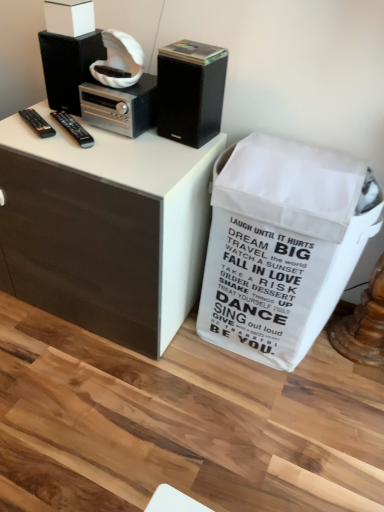
The height and width of the screenshot is (512, 384). Describe the element at coordinates (69, 17) in the screenshot. I see `white matte box at upper left` at that location.

What is the approximate width of black plastic remote at left, the 2th remote control from the right?

The width of black plastic remote at left, the 2th remote control from the right, is 1.70 inches.

Where is `silver metallic stereo at upper center`? silver metallic stereo at upper center is located at coordinates (120, 106).

Image resolution: width=384 pixels, height=512 pixels. Describe the element at coordinates (190, 91) in the screenshot. I see `black matte speaker at upper right, which is counted as the first loudspeaker, starting from the right` at that location.

In order to face black matte speaker at upper right, which is counted as the first loudspeaker, starting from the right, should I rotate leftwards or rightwards?

A 0.259 degree turn to the left will do.

What do you see at coordinates (68, 66) in the screenshot? I see `black matte speaker at upper left, which is the second loudspeaker from right to left` at bounding box center [68, 66].

Locate an element on the screen. The width and height of the screenshot is (384, 512). white matte trash bin/can at lower right is located at coordinates (282, 245).

Which object is wider, silver metallic stereo at upper center or black plastic remote at left, arranged as the second remote control when viewed from the left?

silver metallic stereo at upper center.

Which of these two, silver metallic stereo at upper center or black plastic remote at left, which is counted as the first remote control, starting from the right, is smaller?

With smaller size is black plastic remote at left, which is counted as the first remote control, starting from the right.

Is point (109, 103) behind point (65, 118)?

No, it is in front of (65, 118).

Is silver metallic stereo at upper center placed right next to black plastic remote at left, arranged as the second remote control when viewed from the left?

silver metallic stereo at upper center is not next to black plastic remote at left, arranged as the second remote control when viewed from the left, and they're not touching.

From the image's perspective, between white matte box at upper left and black plastic remote at left, the 2th remote control from the right, who is located below?

black plastic remote at left, the 2th remote control from the right, appears lower in the image.

Is white matte box at upper left placed right next to black plastic remote at left, arranged as the first remote control when viewed from the left?

No.

Is white matte box at upper left in front of or behind black plastic remote at left, arranged as the first remote control when viewed from the left, in the image?

Clearly, white matte box at upper left is in front of black plastic remote at left, arranged as the first remote control when viewed from the left.

In the scene shown: Between white matte box at upper left and black plastic remote at left, the 2th remote control from the right, which one appears on the left side from the viewer's perspective?

black plastic remote at left, the 2th remote control from the right.

From a real-world perspective, which is physically above, black plastic remote at left, arranged as the first remote control when viewed from the left, or black plastic remote at left, arranged as the second remote control when viewed from the left?

black plastic remote at left, arranged as the second remote control when viewed from the left, from a real-world perspective.

Can you confirm if black plastic remote at left, the 2th remote control from the right, is positioned to the right of black plastic remote at left, which is counted as the first remote control, starting from the right?

No, black plastic remote at left, the 2th remote control from the right, is not to the right of black plastic remote at left, which is counted as the first remote control, starting from the right.

Which object is wider, black plastic remote at left, arranged as the first remote control when viewed from the left, or black plastic remote at left, arranged as the second remote control when viewed from the left?

black plastic remote at left, arranged as the second remote control when viewed from the left, is wider.

Considering their positions, is white matte trash bin/can at lower right located in front of or behind black matte speaker at upper left, which is the second loudspeaker from right to left?

Visually, white matte trash bin/can at lower right is located in front of black matte speaker at upper left, which is the second loudspeaker from right to left.

Is white matte trash bin/can at lower right looking in the opposite direction of black matte speaker at upper left, which is the second loudspeaker from right to left?

white matte trash bin/can at lower right does not have its back to black matte speaker at upper left, which is the second loudspeaker from right to left.

Looking at this image, does white matte trash bin/can at lower right touch black matte speaker at upper left, which is the 1th loudspeaker in left-to-right order?

No, white matte trash bin/can at lower right is not touching black matte speaker at upper left, which is the 1th loudspeaker in left-to-right order.

Is black matte speaker at upper right, which is counted as the first loudspeaker, starting from the right, turned away from black plastic remote at left, arranged as the second remote control when viewed from the left?

No.

Locate an element on the screen. This screenshot has height=512, width=384. the 1st remote control counting from the left side of the black matte speaker at upper right, the 2th loudspeaker viewed from the left is located at coordinates (74, 129).

From a real-world perspective, is black matte speaker at upper right, which is counted as the first loudspeaker, starting from the right, located beneath black plastic remote at left, arranged as the second remote control when viewed from the left?

No.

Considering the relative positions of black matte speaker at upper right, the 2th loudspeaker viewed from the left, and black plastic remote at left, the 2th remote control from the right, in the image provided, is black matte speaker at upper right, the 2th loudspeaker viewed from the left, behind black plastic remote at left, the 2th remote control from the right,?

No, black matte speaker at upper right, the 2th loudspeaker viewed from the left, is closer to the viewer.

Between point (224, 62) and point (45, 129), which one is positioned behind?

The point (224, 62) is farther from the camera.

From the image's perspective, count 1st remote controls downward from the black matte speaker at upper right, which is counted as the first loudspeaker, starting from the right, and point to it. Please provide its 2D coordinates.

[(37, 123)]

Is black matte speaker at upper left, which is the second loudspeaker from right to left, completely or partially outside of black plastic remote at left, arranged as the first remote control when viewed from the left?

Indeed, black matte speaker at upper left, which is the second loudspeaker from right to left, is completely outside black plastic remote at left, arranged as the first remote control when viewed from the left.

Is black matte speaker at upper left, which is the second loudspeaker from right to left, in front of or behind black plastic remote at left, the 2th remote control from the right, in the image?

black matte speaker at upper left, which is the second loudspeaker from right to left, is in front of black plastic remote at left, the 2th remote control from the right.

From the image's perspective, count 2nd loudspeakers upward from the black plastic remote at left, arranged as the first remote control when viewed from the left, and point to it. Please provide its 2D coordinates.

[(68, 66)]

Is black matte speaker at upper left, which is the second loudspeaker from right to left, facing towards black plastic remote at left, the 2th remote control from the right?

Yes, black matte speaker at upper left, which is the second loudspeaker from right to left, is aimed at black plastic remote at left, the 2th remote control from the right.

Where is `remote control that is the 2nd one when counting downward from the silver metallic stereo at upper center (from the image's perspective)`? This screenshot has width=384, height=512. remote control that is the 2nd one when counting downward from the silver metallic stereo at upper center (from the image's perspective) is located at coordinates (74, 129).

Locate an element on the screen. The width and height of the screenshot is (384, 512). box above the black plastic remote at left, the 2th remote control from the right (from the image's perspective) is located at coordinates (69, 17).

From the image, which object appears to be farther from black matte speaker at upper left, which is the 1th loudspeaker in left-to-right order, black plastic remote at left, arranged as the first remote control when viewed from the left, or black plastic remote at left, which is counted as the first remote control, starting from the right?

Based on the image, black plastic remote at left, arranged as the first remote control when viewed from the left, appears to be further to black matte speaker at upper left, which is the 1th loudspeaker in left-to-right order.

When comparing their distances from white matte trash bin/can at lower right, does black matte speaker at upper right, which is counted as the first loudspeaker, starting from the right, or silver metallic stereo at upper center seem closer?

black matte speaker at upper right, which is counted as the first loudspeaker, starting from the right, is closer to white matte trash bin/can at lower right.

Consider the image. Based on their spatial positions, is black plastic remote at left, which is counted as the first remote control, starting from the right, or silver metallic stereo at upper center closer to white matte box at upper left?

silver metallic stereo at upper center lies closer to white matte box at upper left than the other object.

When comparing their distances from silver metallic stereo at upper center, does black plastic remote at left, arranged as the second remote control when viewed from the left, or black matte speaker at upper left, which is the second loudspeaker from right to left, seem further?

Among the two, black plastic remote at left, arranged as the second remote control when viewed from the left, is located further to silver metallic stereo at upper center.

Looking at the image, which one is located further to silver metallic stereo at upper center, black matte speaker at upper left, which is the second loudspeaker from right to left, or black plastic remote at left, arranged as the second remote control when viewed from the left?

Among the two, black plastic remote at left, arranged as the second remote control when viewed from the left, is located further to silver metallic stereo at upper center.

Estimate the real-world distances between objects in this image. Which object is further from white matte trash bin/can at lower right, black plastic remote at left, which is counted as the first remote control, starting from the right, or silver metallic stereo at upper center?

black plastic remote at left, which is counted as the first remote control, starting from the right, lies further to white matte trash bin/can at lower right than the other object.

Which object lies nearer to the anchor point silver metallic stereo at upper center, black matte speaker at upper left, which is the second loudspeaker from right to left, or black plastic remote at left, arranged as the first remote control when viewed from the left?

black matte speaker at upper left, which is the second loudspeaker from right to left.

Considering their positions, is black matte speaker at upper left, which is the 1th loudspeaker in left-to-right order, positioned closer to black plastic remote at left, arranged as the second remote control when viewed from the left, than black matte speaker at upper right, the 2th loudspeaker viewed from the left?

Among the two, black matte speaker at upper left, which is the 1th loudspeaker in left-to-right order, is located nearer to black plastic remote at left, arranged as the second remote control when viewed from the left.

The width and height of the screenshot is (384, 512). Find the location of `appliance that lies between white matte box at upper left and black plastic remote at left, arranged as the second remote control when viewed from the left, from top to bottom`. appliance that lies between white matte box at upper left and black plastic remote at left, arranged as the second remote control when viewed from the left, from top to bottom is located at coordinates (120, 106).

The image size is (384, 512). I want to click on loudspeaker between silver metallic stereo at upper center and white matte trash bin/can at lower right in the vertical direction, so click(190, 91).

Locate an element on the screen. appliance between black matte speaker at upper left, which is the 1th loudspeaker in left-to-right order, and white matte trash bin/can at lower right from left to right is located at coordinates (120, 106).

The width and height of the screenshot is (384, 512). Find the location of `appliance between black matte speaker at upper left, which is the second loudspeaker from right to left, and black matte speaker at upper right, the 2th loudspeaker viewed from the left`. appliance between black matte speaker at upper left, which is the second loudspeaker from right to left, and black matte speaker at upper right, the 2th loudspeaker viewed from the left is located at coordinates (120, 106).